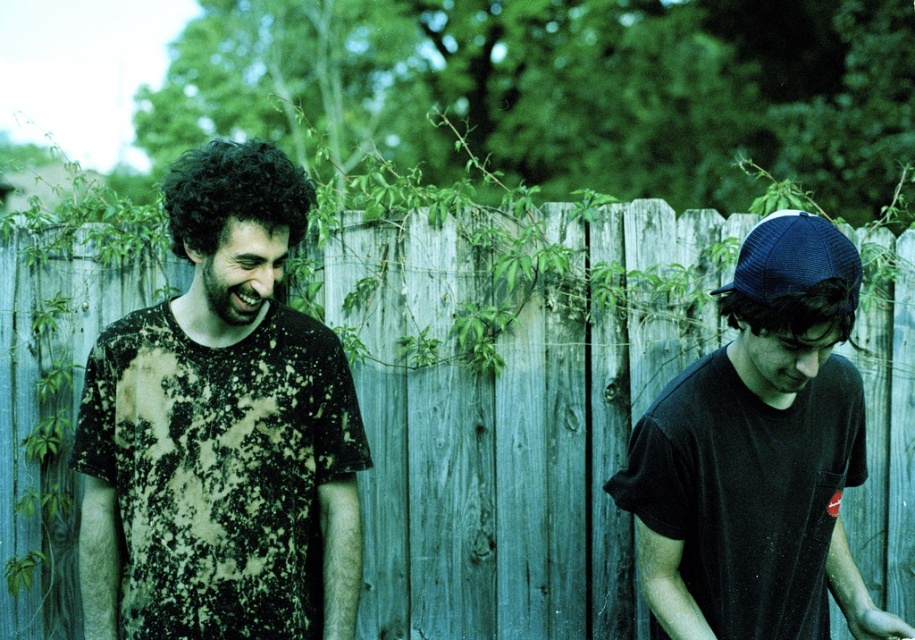
Is point (257, 538) closer to viewer compared to point (795, 253)?

No, it is behind (795, 253).

Does point (148, 589) lie behind point (841, 452)?

No.

This screenshot has width=915, height=640. What are the coordinates of `distressed black t-shirt at left` in the screenshot? It's located at (221, 428).

Between weathered wood fence at center and black matte t-shirt at right, which one appears on the left side from the viewer's perspective?

Positioned to the left is weathered wood fence at center.

Can you confirm if weathered wood fence at center is smaller than black matte t-shirt at right?

Incorrect, weathered wood fence at center is not smaller in size than black matte t-shirt at right.

The image size is (915, 640). I want to click on weathered wood fence at center, so click(x=513, y=413).

Does weathered wood fence at center lie in front of distressed black t-shirt at left?

No, it is not.

Who is more distant from viewer, (366, 269) or (305, 467)?

The point (366, 269) is more distant.

I want to click on weathered wood fence at center, so click(x=513, y=413).